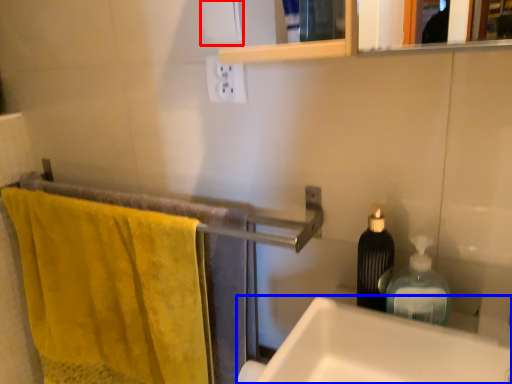
Question: Among these objects, which one is nearest to the camera, toilet paper (highlighted by a red box) or sink (highlighted by a blue box)?

Choices:
 (A) toilet paper
 (B) sink

Answer: (B)